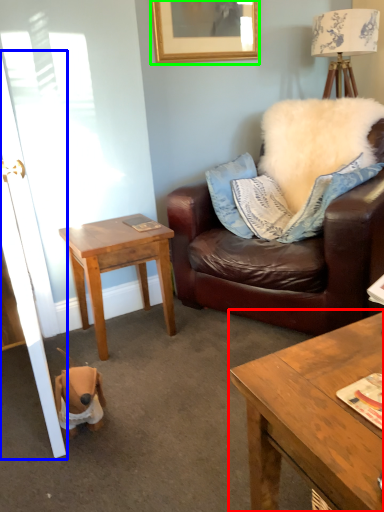
Question: Which is nearer to the coffee table (highlighted by a red box)? door (highlighted by a blue box) or picture frame (highlighted by a green box).

Choices:
 (A) door
 (B) picture frame

Answer: (A)